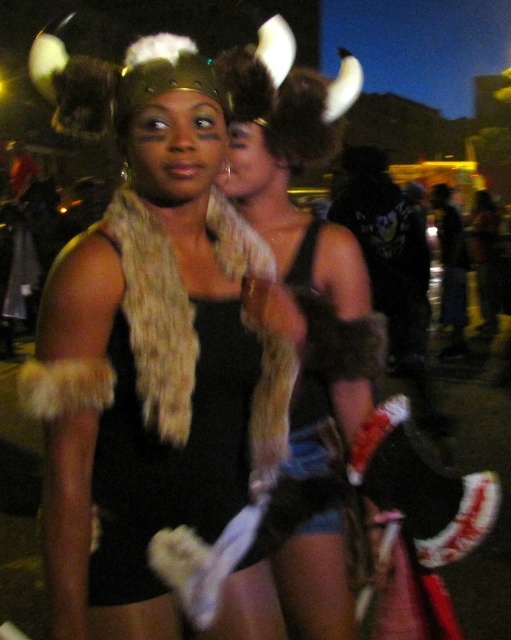
Is point (204, 230) farther from camera compared to point (459, 294)?

No.

What do you see at coordinates (153, 330) in the screenshot?
I see `fur scarf at center` at bounding box center [153, 330].

This screenshot has height=640, width=511. In order to click on fur scarf at center in this screenshot , I will do `click(153, 330)`.

The height and width of the screenshot is (640, 511). Describe the element at coordinates (290, 161) in the screenshot. I see `fur-like scarf at center` at that location.

Is fur-like scarf at center to the left of dark blue fabric pants at lower right from the viewer's perspective?

Yes, fur-like scarf at center is to the left of dark blue fabric pants at lower right.

I want to click on fur-like scarf at center, so click(290, 161).

Who is positioned more to the left, fur scarf at center or fur-like scarf at center?

Positioned to the left is fur scarf at center.

Is fur scarf at center positioned in front of fur-like scarf at center?

That is True.

Which is in front, point (208, 278) or point (329, 547)?

Point (208, 278)

Locate an element on the screen. fur scarf at center is located at coordinates (153, 330).